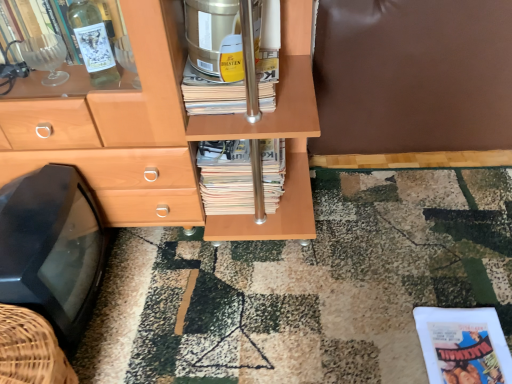
At what (x,y) coordinates should I click in order to perform the action: click on free space to the left of matte white paperback book at lower right. Please return your answer as a coordinate pair (x, y). This screenshot has width=512, height=384. Looking at the image, I should click on (372, 341).